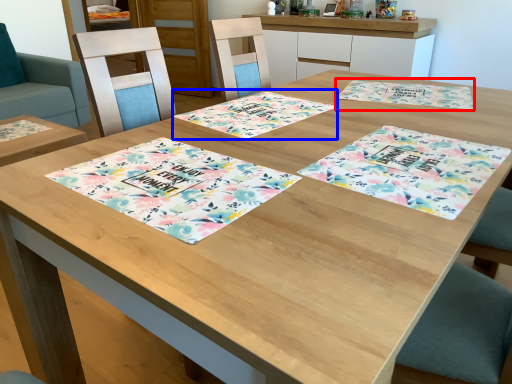
Question: Which of the following is the closest to the observer, place mat (highlighted by a red box) or place mat (highlighted by a blue box)?

Choices:
 (A) place mat
 (B) place mat

Answer: (B)